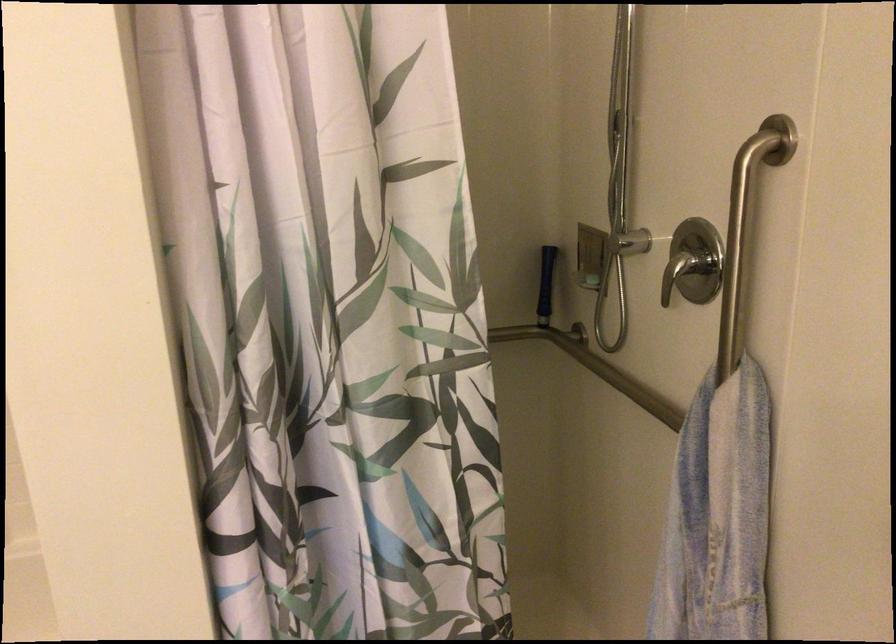
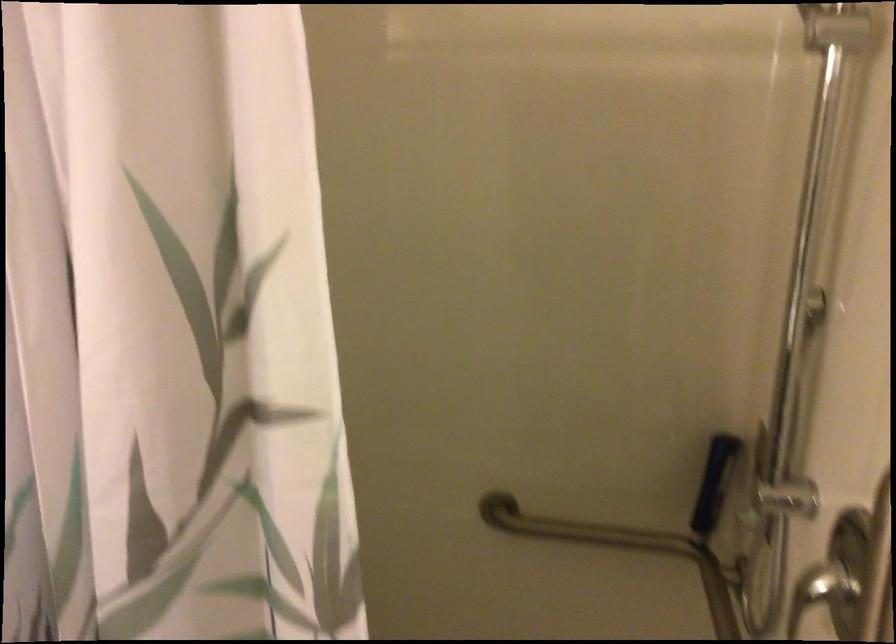
In the second image, find the point that corresponds to [625,230] in the first image.

(776, 488)